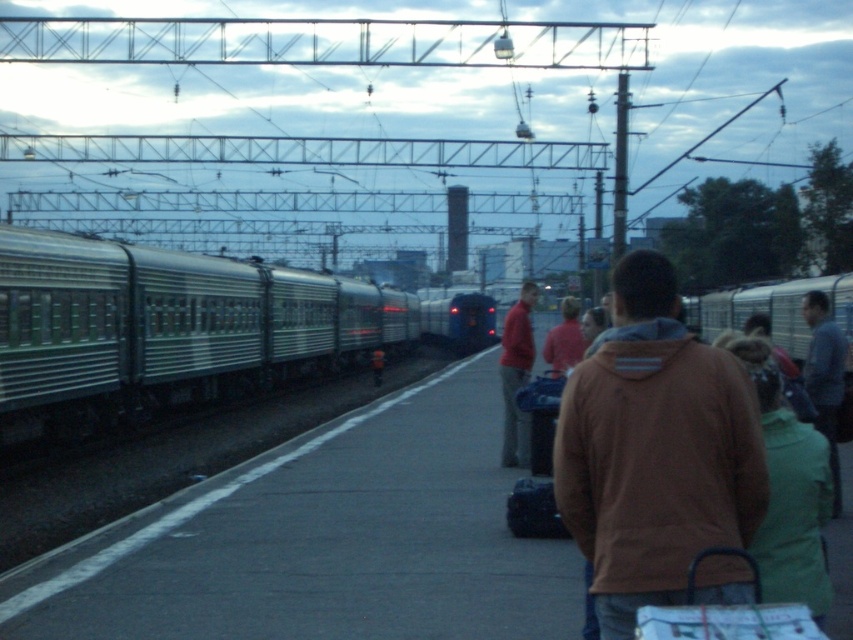
You are a passenger waiting at the train station. You see the green metallic train at left and the brown hoodie at center. Which object is positioned higher relative to your viewpoint?

The green metallic train at left is positioned higher than the brown hoodie at center from your viewpoint.

You are a photographer standing on the platform at the train station. You want to take a photo of the brown hoodie at center and the dark gray metallic train at center. Which object will appear taller in the photo?

The dark gray metallic train at center will appear taller in the photo because it is taller than the brown hoodie at center.

From the picture: You are standing on the platform at the train station and see the green metallic train at left and the brown hoodie at center. Which object is positioned more to the left side of the platform?

The green metallic train at left is positioned more to the left side of the platform than the brown hoodie at center.